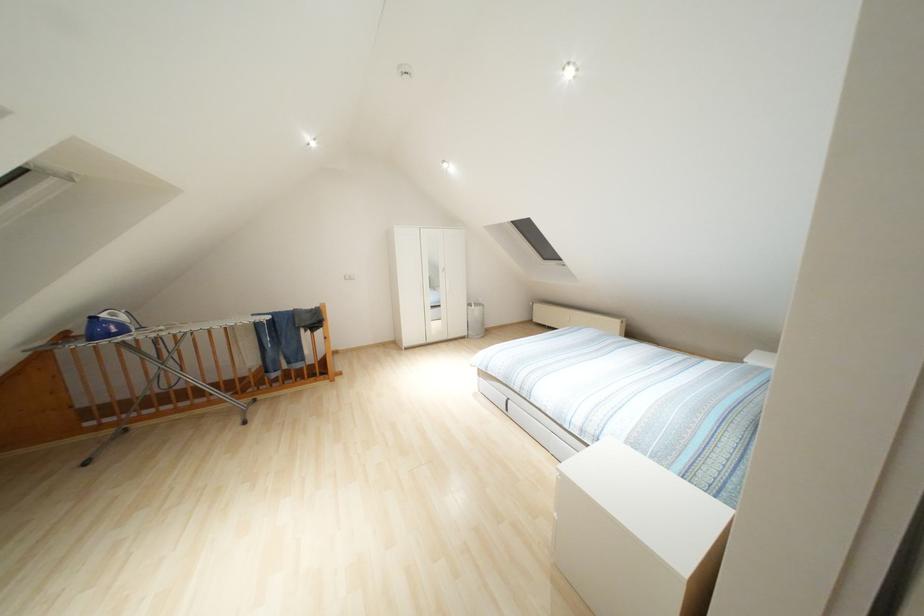
Image resolution: width=924 pixels, height=616 pixels. In order to click on blue and white iron in this screenshot , I will do `click(108, 325)`.